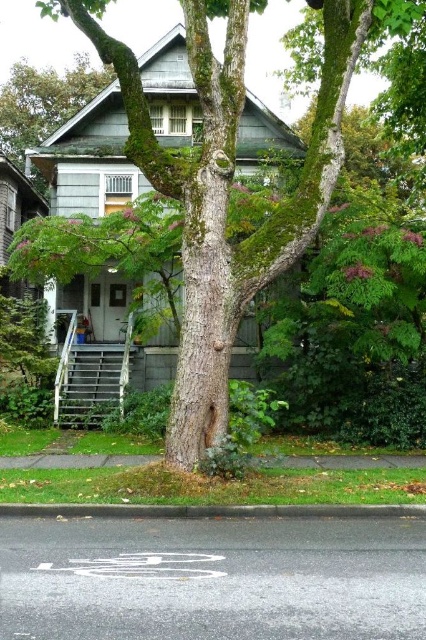
Question: Does green mossy tree at center have a larger size compared to green mossy tree at upper left?

Choices:
 (A) yes
 (B) no

Answer: (B)

Question: Which object is closer to the camera taking this photo?

Choices:
 (A) green mossy tree at center
 (B) green mossy tree at upper left

Answer: (A)

Question: Can you confirm if green mossy tree at center is bigger than green mossy tree at upper left?

Choices:
 (A) yes
 (B) no

Answer: (B)

Question: Among these objects, which one is farthest from the camera?

Choices:
 (A) green mossy tree at center
 (B) green mossy tree at upper left

Answer: (B)

Question: Is the position of green mossy tree at center more distant than that of green mossy tree at upper left?

Choices:
 (A) yes
 (B) no

Answer: (B)